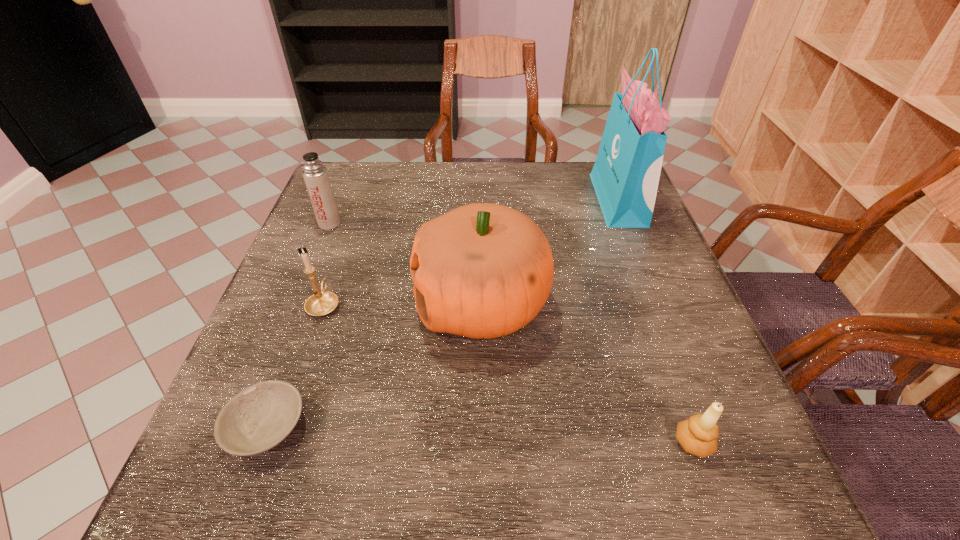
The image size is (960, 540). I want to click on free space at the far edge of the desktop, so click(x=450, y=194).

Image resolution: width=960 pixels, height=540 pixels. In the image, there is a desktop. Identify the location of free region at the near edge. (512, 500).

This screenshot has width=960, height=540. What are the coordinates of `free region at the left edge of the desktop` in the screenshot? It's located at (244, 354).

Find the location of `free space at the right edge`. free space at the right edge is located at coordinates (663, 284).

In the image, there is a desktop. Where is `vacant space at the far left corner`? vacant space at the far left corner is located at coordinates (359, 192).

Image resolution: width=960 pixels, height=540 pixels. In order to click on vacant space at the far right corner of the desktop in this screenshot , I will do `click(578, 188)`.

Where is `free space at the near right corner of the desktop`? free space at the near right corner of the desktop is located at coordinates (757, 500).

At what (x,y) coordinates should I click in order to perform the action: click on vacant area that lies between the pumpkin and the left candle_holder. Please return your answer as a coordinate pair (x, y). This screenshot has height=540, width=960. Looking at the image, I should click on (403, 304).

Where is `vacant space that is in between the right candle_holder and the tallest object`? vacant space that is in between the right candle_holder and the tallest object is located at coordinates (656, 321).

Locate an element on the screen. The height and width of the screenshot is (540, 960). free spot between the right candle_holder and the shortest object is located at coordinates (480, 435).